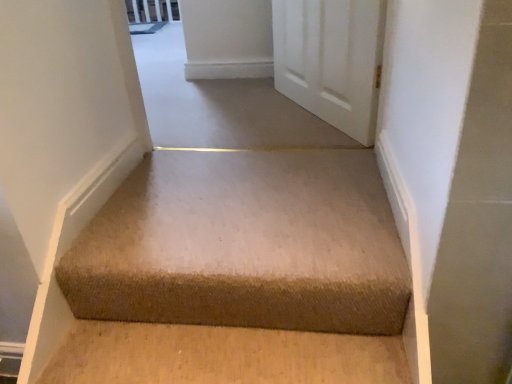
Describe the element at coordinates (239, 274) in the screenshot. I see `beige carpet at center` at that location.

You are a GUI agent. You are given a task and a screenshot of the screen. Output one action in this format:
    pyautogui.click(x=<x>, y=<y>)
    Task: Click on the beige carpet at center
    
    Given the screenshot: What is the action you would take?
    pyautogui.click(x=239, y=274)

What do you see at coordinates (295, 52) in the screenshot?
I see `beige carpet at upper center` at bounding box center [295, 52].

Image resolution: width=512 pixels, height=384 pixels. Find the location of `beige carpet at upper center`. beige carpet at upper center is located at coordinates (295, 52).

Identify the location of beige carpet at center. The width and height of the screenshot is (512, 384). pyautogui.click(x=239, y=274).

Considering the relative positions of beige carpet at center and beige carpet at upper center in the image provided, is beige carpet at center to the left of beige carpet at upper center from the viewer's perspective?

Incorrect, beige carpet at center is not on the left side of beige carpet at upper center.

Consider the image. In the image, is beige carpet at center positioned in front of or behind beige carpet at upper center?

beige carpet at center is in front of beige carpet at upper center.

Consider the image. Which is closer to the camera, [335,251] or [381,21]?

The point [335,251] is closer.

From the image's perspective, between beige carpet at center and beige carpet at upper center, which one is located above?

beige carpet at upper center, from the image's perspective.

From a real-world perspective, who is located higher, beige carpet at center or beige carpet at upper center?

From a 3D spatial view, beige carpet at upper center is above.

Between beige carpet at center and beige carpet at upper center, which one has larger width?

With larger width is beige carpet at upper center.

In terms of height, does beige carpet at center look taller or shorter compared to beige carpet at upper center?

In the image, beige carpet at center appears to be shorter than beige carpet at upper center.

Does beige carpet at center have a smaller size compared to beige carpet at upper center?

Yes.

Is beige carpet at center completely or partially outside of beige carpet at upper center?

beige carpet at center is positioned outside beige carpet at upper center.

Is there a large distance between beige carpet at center and beige carpet at upper center?

Actually, beige carpet at center and beige carpet at upper center are a little close together.

Is beige carpet at center facing away from beige carpet at upper center?

No, beige carpet at center is not facing away from beige carpet at upper center.

Measure the distance from beige carpet at center to beige carpet at upper center.

beige carpet at center and beige carpet at upper center are 30.13 inches apart from each other.

Locate an element on the screen. The image size is (512, 384). stairwell below the beige carpet at upper center (from a real-world perspective) is located at coordinates (239, 274).

Considering the relative positions of beige carpet at upper center and beige carpet at center in the image provided, is beige carpet at upper center to the right of beige carpet at center from the viewer's perspective?

No, beige carpet at upper center is not to the right of beige carpet at center.

Is the position of beige carpet at upper center less distant than that of beige carpet at center?

No, beige carpet at upper center is further to the viewer.

Between point (356, 81) and point (322, 187), which one is positioned behind?

The point (356, 81) is behind.

From the image's perspective, who appears lower, beige carpet at upper center or beige carpet at center?

beige carpet at center is shown below in the image.

From a real-world perspective, is beige carpet at upper center physically above beige carpet at center?

Correct, in the physical world, beige carpet at upper center is higher than beige carpet at center.

Which of these two, beige carpet at upper center or beige carpet at center, is thinner?

beige carpet at center is thinner.

Considering the relative sizes of beige carpet at upper center and beige carpet at center in the image provided, is beige carpet at upper center taller than beige carpet at center?

Indeed, beige carpet at upper center has a greater height compared to beige carpet at center.

Considering the sizes of beige carpet at upper center and beige carpet at center in the image, is beige carpet at upper center bigger or smaller than beige carpet at center?

In the image, beige carpet at upper center appears to be larger than beige carpet at center.

Is beige carpet at upper center not inside beige carpet at center?

Yes, beige carpet at upper center is outside of beige carpet at center.

Would you say beige carpet at upper center is a long distance from beige carpet at center?

Actually, beige carpet at upper center and beige carpet at center are a little close together.

Is beige carpet at upper center oriented away from beige carpet at center?

No.

How much distance is there between beige carpet at upper center and beige carpet at center?

30.13 inches.

This screenshot has height=384, width=512. I want to click on passage above the beige carpet at center (from the image's perspective), so click(x=295, y=52).

Find the location of a particular element. Image resolution: width=512 pixels, height=384 pixels. stairwell to the right of beige carpet at upper center is located at coordinates pos(239,274).

The height and width of the screenshot is (384, 512). Identify the location of stairwell located below the beige carpet at upper center (from the image's perspective). (239, 274).